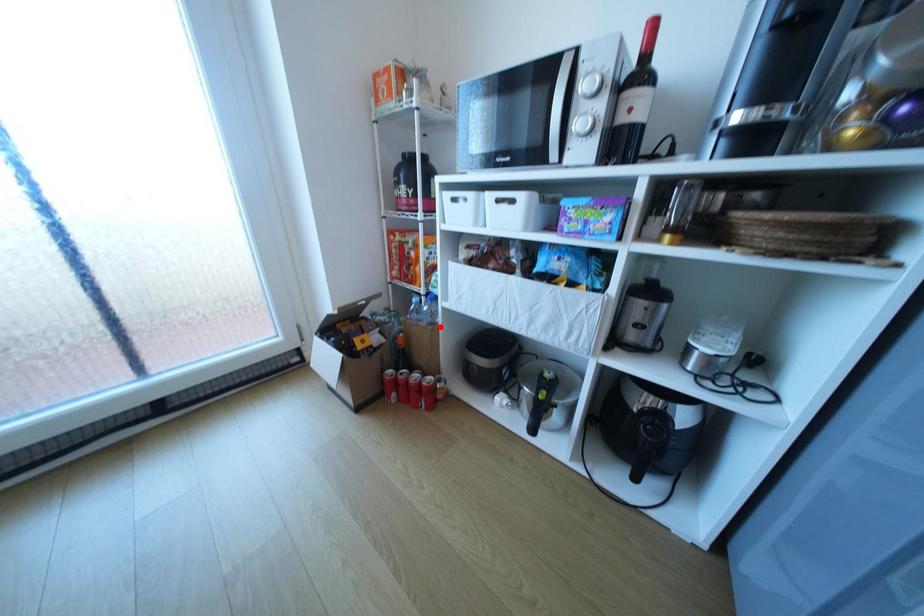
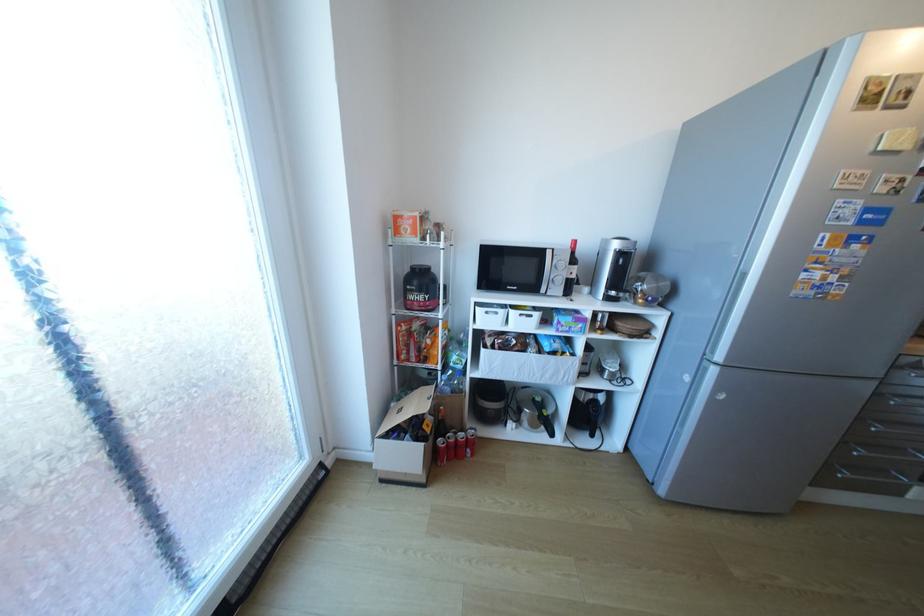
Question: I am providing you with two images of the same scene from different viewpoints. Given a red point in image1, look at the same physical point in image2. Is it:

Choices:
 (A) Closer to the viewpoint
 (B) Farther from the viewpoint

Answer: (B)